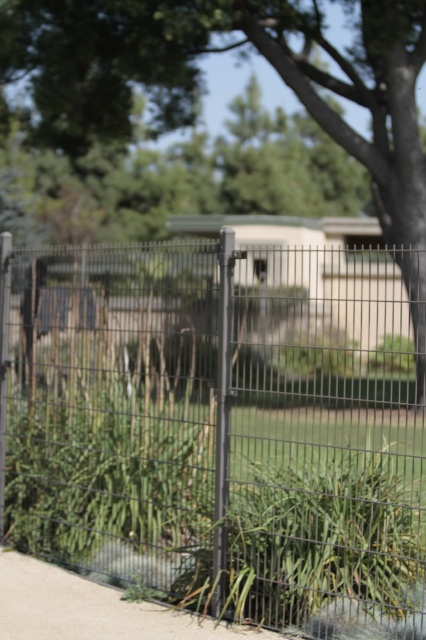
Question: Can you confirm if black wire mesh fence at center is thinner than green leafy tree at upper center?

Choices:
 (A) yes
 (B) no

Answer: (A)

Question: Is black wire mesh fence at center wider than green leafy tree at upper center?

Choices:
 (A) no
 (B) yes

Answer: (A)

Question: Can you confirm if black wire mesh fence at center is bigger than green leafy tree at upper center?

Choices:
 (A) yes
 (B) no

Answer: (B)